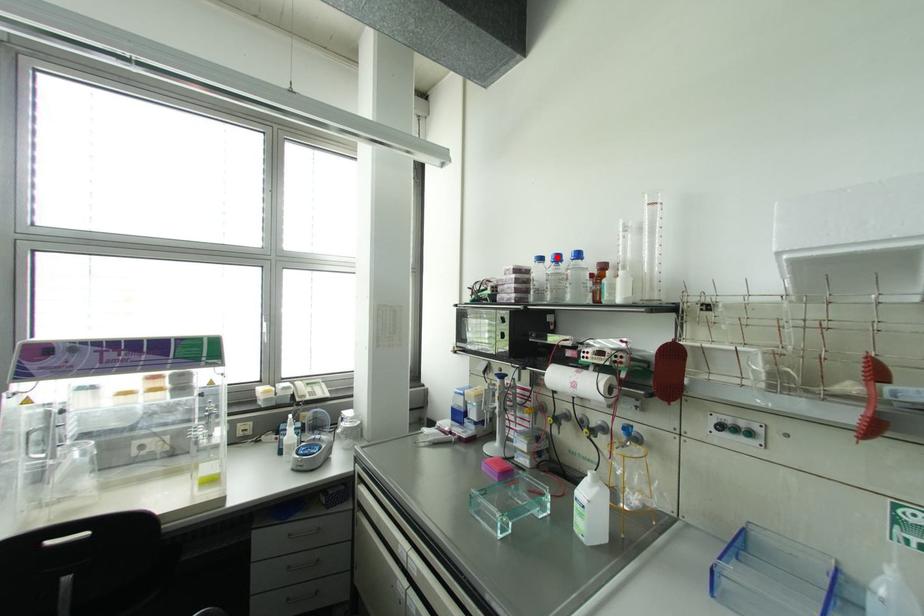
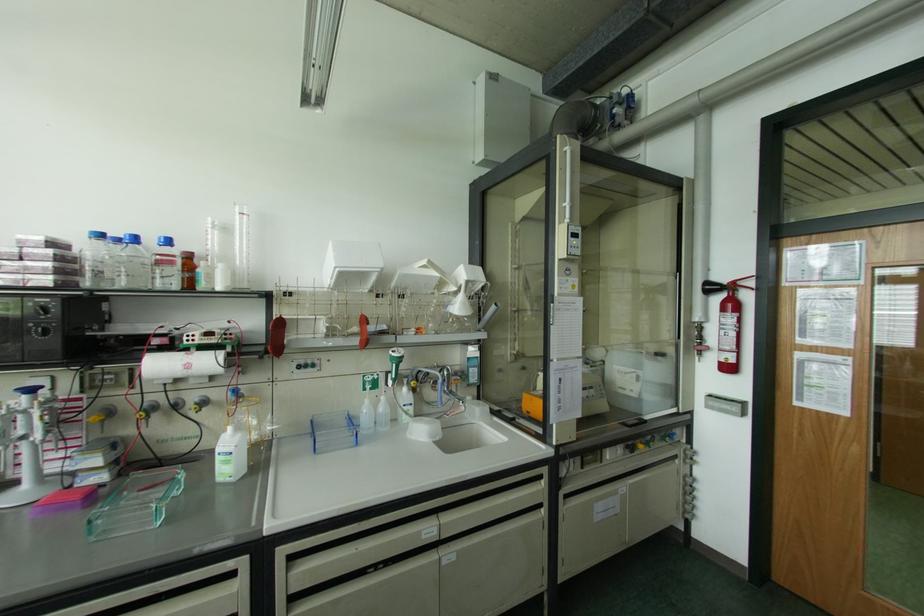
Where in the second image is the point corresponding to the highlighted location from the first image?

(134, 238)